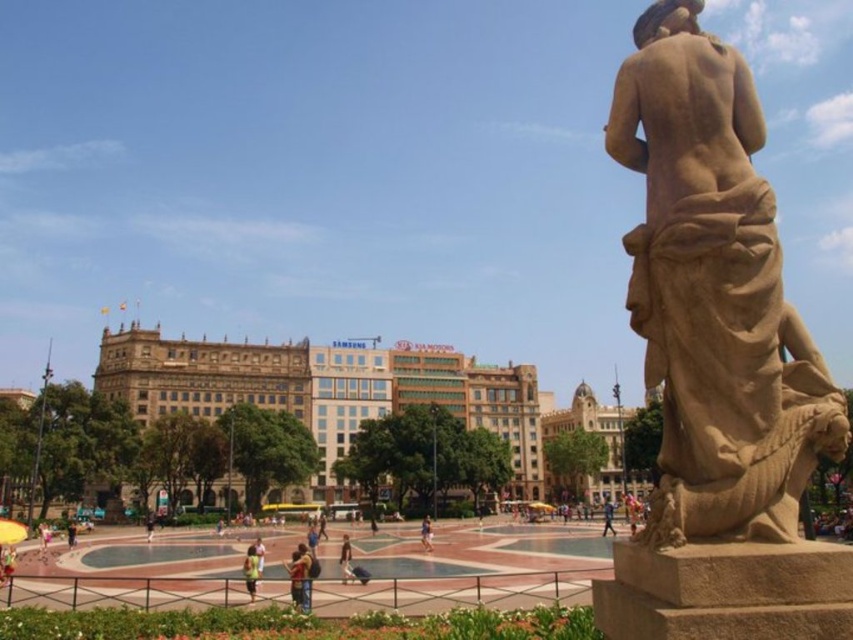
Is the position of yellow fabric bag at lower center more distant than that of light brown leather jacket at lower center?

No, it is in front of light brown leather jacket at lower center.

Is yellow fabric bag at lower center to the left of light brown leather jacket at lower center from the viewer's perspective?

No, yellow fabric bag at lower center is not to the left of light brown leather jacket at lower center.

Describe the element at coordinates (251, 570) in the screenshot. I see `yellow fabric bag at lower center` at that location.

The height and width of the screenshot is (640, 853). I want to click on yellow fabric bag at lower center, so click(x=251, y=570).

Is point (294, 563) farther from camera compared to point (44, 528)?

No.

Based on the photo, who is more forward, (289, 580) or (49, 531)?

Positioned in front is point (289, 580).

At what (x,y) coordinates should I click in order to perform the action: click on denim jeans at lower center. Please return your answer as a coordinate pair (x, y). Looking at the image, I should click on (299, 577).

Which of these two, light brown stone statue at right or light brown statue at center, stands shorter?

light brown statue at center is shorter.

What do you see at coordinates (607, 516) in the screenshot?
I see `light brown stone statue at right` at bounding box center [607, 516].

Is point (604, 513) farther from camera compared to point (428, 525)?

Yes, it is.

Identify the location of light brown stone statue at right. Image resolution: width=853 pixels, height=640 pixels. (607, 516).